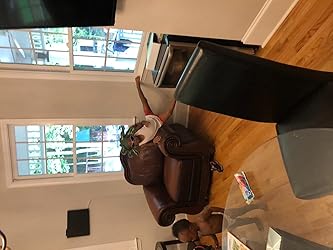
Locate an element on the screen. baseboard is located at coordinates 275,14, 184,118.